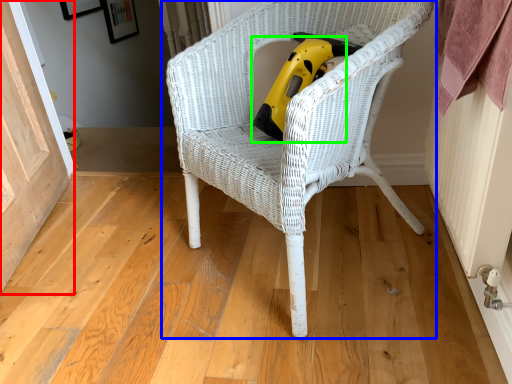
Question: Estimate the real-world distances between objects in this image. Which object is closer to screen door (highlighted by a red box), chair (highlighted by a blue box) or vacuum (highlighted by a green box)?

Choices:
 (A) chair
 (B) vacuum

Answer: (A)